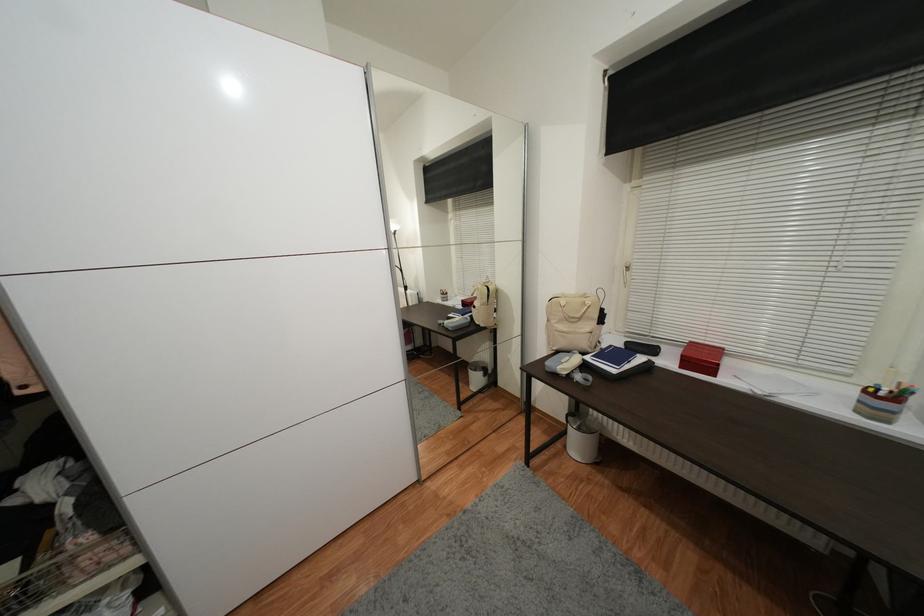
Find the location of `white window handle`. white window handle is located at coordinates (626, 273).